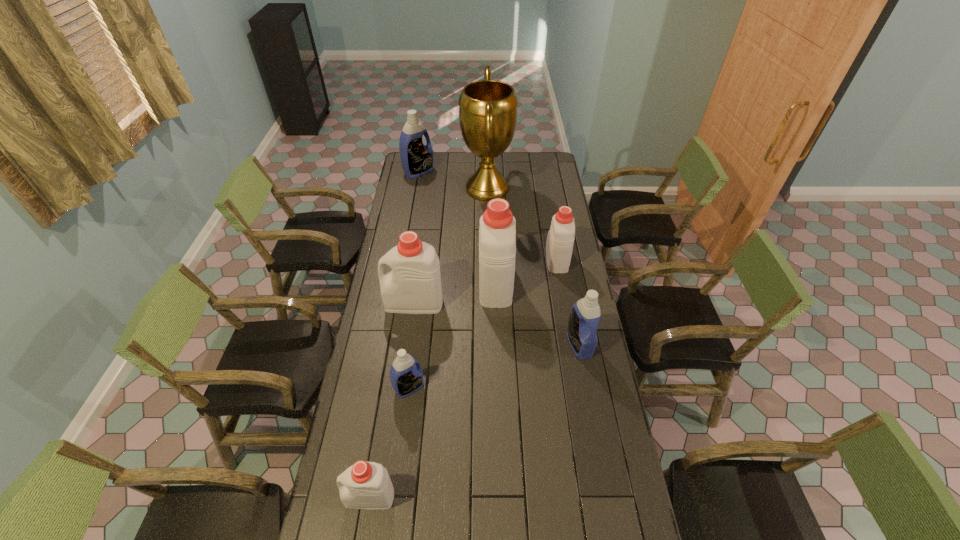
Where is `free region at the far edge of the desktop`? The width and height of the screenshot is (960, 540). free region at the far edge of the desktop is located at coordinates point(468,173).

Locate an element on the screen. This screenshot has height=540, width=960. free point at the left edge is located at coordinates (416, 222).

The width and height of the screenshot is (960, 540). I want to click on vacant area at the far right corner of the desktop, so click(558, 170).

Locate an element on the screen. This screenshot has height=540, width=960. free space that is in between the smallest blue detergent and the rightmost white detergent is located at coordinates tap(483, 323).

The height and width of the screenshot is (540, 960). Identify the location of free area in between the rightmost blue detergent and the rightmost white detergent. (568, 301).

This screenshot has height=540, width=960. What are the coordinates of `vacant space in between the smallest blue detergent and the third nearest detergent` in the screenshot? It's located at (494, 366).

Where is `free space between the third nearest detergent and the trophy cup`? The height and width of the screenshot is (540, 960). free space between the third nearest detergent and the trophy cup is located at coordinates (534, 266).

The height and width of the screenshot is (540, 960). What are the coordinates of `vacant space that is in between the farthest detergent and the tallest detergent` in the screenshot? It's located at (457, 227).

The height and width of the screenshot is (540, 960). In order to click on unoccupied area between the tallest detergent and the nearest blue detergent in this screenshot , I will do `click(452, 335)`.

This screenshot has height=540, width=960. I want to click on free space between the second white detergent from right to left and the rightmost white detergent, so click(x=526, y=271).